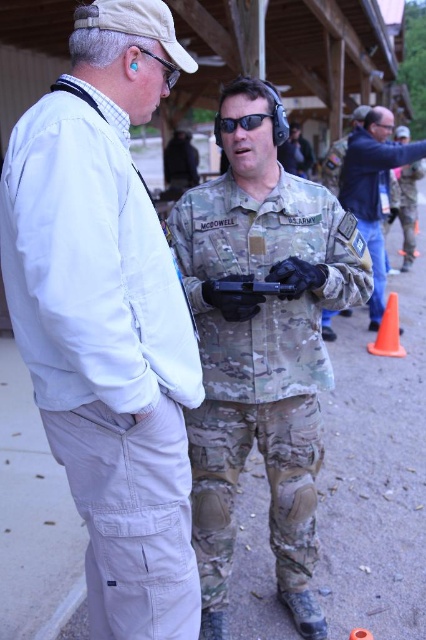
Measure the distance between khaki cotton pants at lower left and camouflage uniform at right.

They are 23.85 feet apart.

Based on the photo, which of these two, khaki cotton pants at lower left or camouflage uniform at right, stands shorter?

camouflage uniform at right

Identify the location of khaki cotton pants at lower left. (108, 320).

Identify the location of khaki cotton pants at lower left. (108, 320).

Is point (247, 116) positioned behind point (178, 74)?

Yes.

Can you confirm if black matte sunglasses at center is smaller than matte black goggles at upper left?

Incorrect, black matte sunglasses at center is not smaller in size than matte black goggles at upper left.

Between point (227, 128) and point (172, 80), which one is positioned in front?

Positioned in front is point (172, 80).

Locate an element on the screen. The height and width of the screenshot is (640, 426). black matte sunglasses at center is located at coordinates (238, 122).

Locate an element on the screen. orange matte cone at lower right is located at coordinates (388, 332).

Who is positioned more to the left, orange matte cone at lower right or black matte sunglasses at center?

black matte sunglasses at center is more to the left.

The image size is (426, 640). I want to click on orange matte cone at lower right, so click(388, 332).